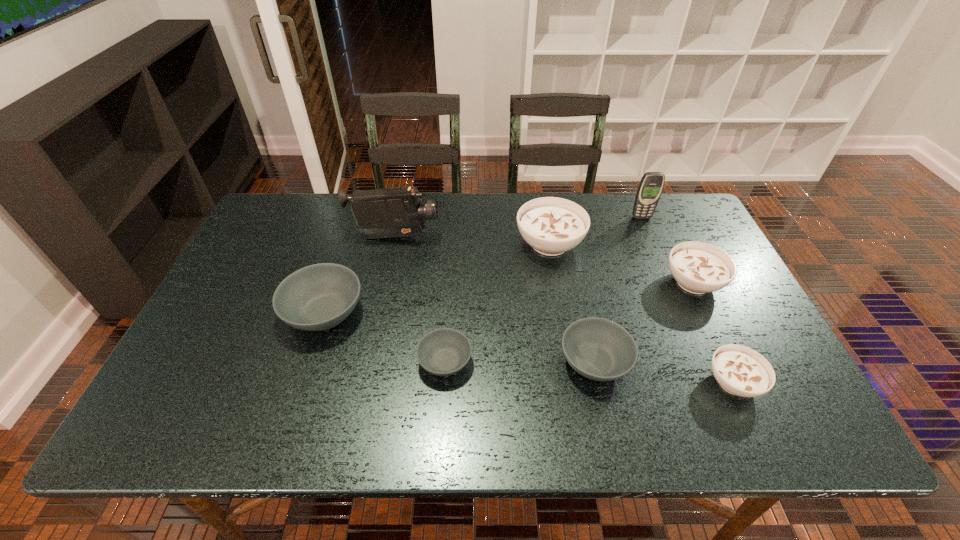
Locate an element on the screen. free space between the nearest white soup bowl and the black camcorder is located at coordinates (564, 309).

At what (x,y) coordinates should I click in order to perform the action: click on vacant space in between the smallest white soup bowl and the leftmost white soup bowl. Please return your answer as a coordinate pair (x, y). The height and width of the screenshot is (540, 960). Looking at the image, I should click on (641, 313).

You are a GUI agent. You are given a task and a screenshot of the screen. Output one action in this format:
    pyautogui.click(x=<x>, y=<y>)
    Task: Click on the free spot between the biggest white soup bowl and the smallest white soup bowl
    The height and width of the screenshot is (540, 960).
    Given the screenshot: What is the action you would take?
    pyautogui.click(x=641, y=313)

Point out which object is positioned as the second nearest to the second biggest gray soup bowl. Please provide its 2D coordinates. Your answer should be formatted as a tuple, i.e. [(x, y)], where the tuple contains the x and y coordinates of a point satisfying the conditions above.

[(698, 267)]

This screenshot has height=540, width=960. Identify the location of object that stands as the fifth closest to the biggest gray soup bowl. (698, 267).

Where is `soup bowl that is the fourth closest to the second biggest gray soup bowl`? soup bowl that is the fourth closest to the second biggest gray soup bowl is located at coordinates (551, 225).

Locate an element on the screen. the closest soup bowl to the rightmost gray soup bowl is located at coordinates (741, 371).

Identify which white soup bowl is located as the third nearest to the leftmost soup bowl. Please provide its 2D coordinates. Your answer should be formatted as a tuple, i.e. [(x, y)], where the tuple contains the x and y coordinates of a point satisfying the conditions above.

[(741, 371)]

Where is `white soup bowl object that ranks as the second closest to the black camcorder`? white soup bowl object that ranks as the second closest to the black camcorder is located at coordinates click(x=698, y=267).

You are a GUI agent. You are given a task and a screenshot of the screen. Output one action in this format:
    pyautogui.click(x=<x>, y=<y>)
    Task: Click on the gray soup bowl that is the second closest to the leftmost soup bowl
    The image size is (960, 540).
    Given the screenshot: What is the action you would take?
    pyautogui.click(x=599, y=349)